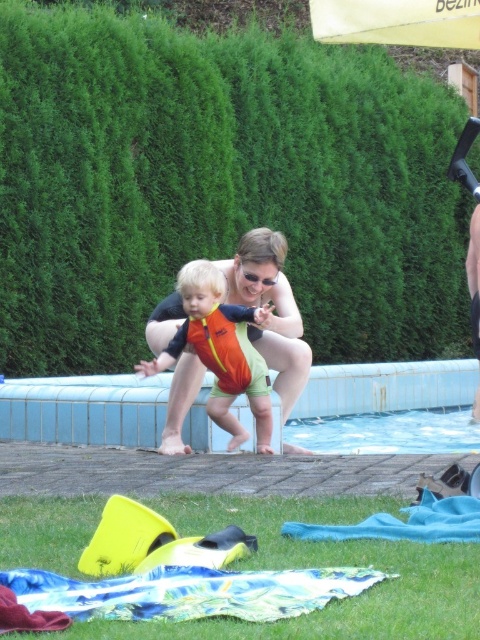
You are planning to place a small table between the blue tile swimming pool at center and the printed fabric blanket at lower center. Based on their widths, which object should the table be placed closer to?

The blue tile swimming pool at center has a lesser width compared to the printed fabric blanket at lower center, so the table should be placed closer to the blue tile swimming pool at center to ensure proper placement based on their widths.

You are a photographer standing at the edge of the pool. You want to take a photo of the orange fabric swimsuit at center without the printed fabric blanket at lower center appearing in the frame. Is this possible based on their positions?

The printed fabric blanket at lower center is located below the orange fabric swimsuit at center, so if you position the camera above the swimsuit, you can avoid capturing the blanket in the frame.